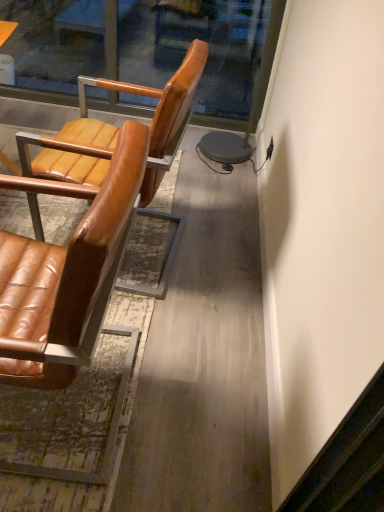
Question: From the image's perspective, is transparent glass door at upper center above or below brown leather chair at left, the 1th chair positioned from the front?

Choices:
 (A) above
 (B) below

Answer: (A)

Question: Looking at their shapes, would you say transparent glass door at upper center is wider or thinner than brown leather chair at left, arranged as the 2th chair when viewed from the back?

Choices:
 (A) wide
 (B) thin

Answer: (B)

Question: Which object is positioned farthest from the brown leather chair at left, the 1th chair positioned from the front?

Choices:
 (A) brown leather chair at left, placed as the second chair when sorted from front to back
 (B) transparent glass door at upper center

Answer: (B)

Question: Which object is the closest to the transparent glass door at upper center?

Choices:
 (A) brown leather chair at left, arranged as the 2th chair when viewed from the back
 (B) brown leather chair at left, which appears as the first chair when viewed from the back

Answer: (B)